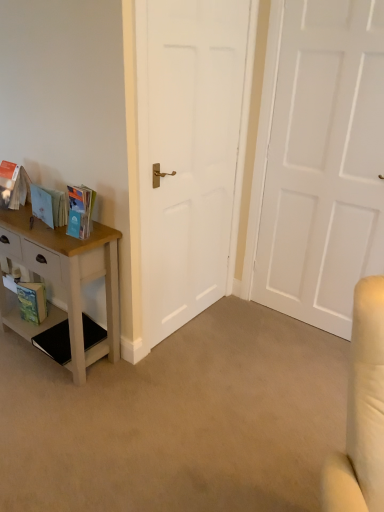
Question: Is green matte paperback book at lower left smaller than matte cardboard book at left, the second book viewed from the left?

Choices:
 (A) yes
 (B) no

Answer: (A)

Question: Is green matte paperback book at lower left positioned behind matte cardboard book at left, the second book positioned from the right?

Choices:
 (A) yes
 (B) no

Answer: (A)

Question: Is green matte paperback book at lower left not within matte cardboard book at left, the second book viewed from the left?

Choices:
 (A) yes
 (B) no

Answer: (A)

Question: Considering the relative sizes of green matte paperback book at lower left and matte cardboard book at left, the second book viewed from the left, in the image provided, is green matte paperback book at lower left taller than matte cardboard book at left, the second book viewed from the left,?

Choices:
 (A) yes
 (B) no

Answer: (A)

Question: Considering the relative sizes of green matte paperback book at lower left and matte cardboard book at left, the second book positioned from the right, in the image provided, is green matte paperback book at lower left thinner than matte cardboard book at left, the second book positioned from the right,?

Choices:
 (A) yes
 (B) no

Answer: (A)

Question: From the image's perspective, is matte cardboard book at left, the second book positioned from the right, located above or below white matte door at center, which is counted as the 1th door, starting from the left?

Choices:
 (A) above
 (B) below

Answer: (B)

Question: Relative to white matte door at center, which appears as the second door when viewed from the right, is matte cardboard book at left, the second book positioned from the right, in front or behind?

Choices:
 (A) behind
 (B) front

Answer: (A)

Question: Based on their sizes in the image, would you say matte cardboard book at left, the second book viewed from the left, is bigger or smaller than white matte door at center, which is counted as the 1th door, starting from the left?

Choices:
 (A) small
 (B) big

Answer: (A)

Question: Is matte cardboard book at left, the second book positioned from the right, inside the boundaries of white matte door at center, which is counted as the 1th door, starting from the left, or outside?

Choices:
 (A) outside
 (B) inside

Answer: (A)

Question: In terms of height, does white matte door at center, the first door positioned from the right, look taller or shorter compared to white painted wood nightstand at left?

Choices:
 (A) short
 (B) tall

Answer: (B)

Question: Based on their sizes in the image, would you say white matte door at center, which appears as the 2th door when viewed from the left, is bigger or smaller than white painted wood nightstand at left?

Choices:
 (A) small
 (B) big

Answer: (A)

Question: Do you think white matte door at center, the first door positioned from the right, is within white painted wood nightstand at left, or outside of it?

Choices:
 (A) outside
 (B) inside

Answer: (A)

Question: From the image's perspective, is white matte door at center, the first door positioned from the right, located above or below white painted wood nightstand at left?

Choices:
 (A) above
 (B) below

Answer: (A)

Question: In the image, is white matte door at center, the first door positioned from the right, positioned in front of or behind green matte paperback book at lower left?

Choices:
 (A) behind
 (B) front

Answer: (B)

Question: From a real-world perspective, is white matte door at center, the first door positioned from the right, above or below green matte paperback book at lower left?

Choices:
 (A) above
 (B) below

Answer: (A)